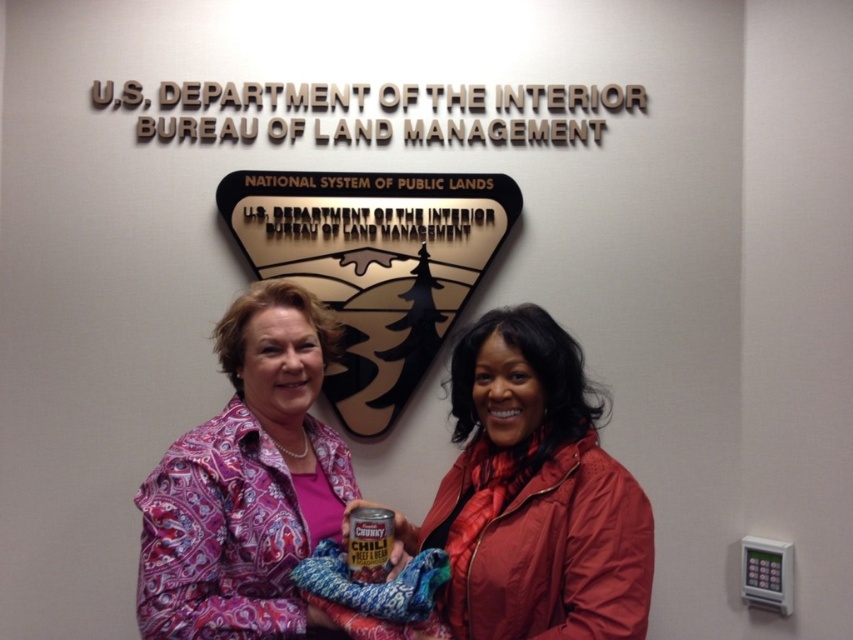
You are an interior designer assessing the layout of this office space. You notice two items at the center of the scene, the red matte jacket at center and the pink paisley shirt at center. Which item takes up more space in the scene?

The pink paisley shirt at center takes up more space than the red matte jacket at center because the red matte jacket at center occupies less space than pink paisley shirt at center.

You are an observer in the scene. You notice two people wearing the red matte jacket at center and the pink paisley shirt at center. From your perspective, which clothing item is positioned lower?

The red matte jacket at center is located below the pink paisley shirt at center, so the red matte jacket at center is positioned lower.

You are a photographer setting up for a group photo. You need to ensure there is enough space between the two people so that both can be in focus. The camera you are using has a depth of field that can cover 16 inches. Is the current distance between the red matte jacket at center and the pink paisley shirt at center sufficient for both to be in focus?

The distance between the red matte jacket at center and the pink paisley shirt at center is 16.60 inches. Since the camera can only cover 16 inches, the current distance is slightly too large for both to be in focus. You will need to move them closer together by approximately 0.6 inches.